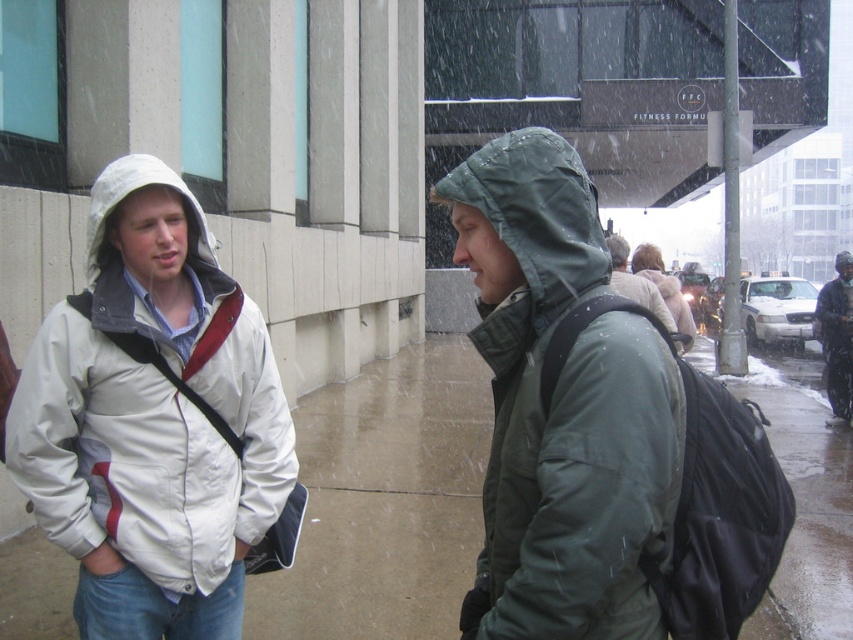
You are a fashion designer observing the two jackets in the image. Which jacket, the green matte jacket at center or the light beige wool coat at center, is narrower in width?

The green matte jacket at center is narrower in width than the light beige wool coat at center.

You are a delivery person trying to locate the recipient standing at the green matte jacket at center. According to the coordinates provided, where exactly should you look to find them?

The green matte jacket at center is located at point (x=561, y=406), so you should look towards those coordinates to find the recipient.

You are a delivery robot with a 1.2 meter wide package. You need to navigate through the space between the green matte jacket at center and the nearest building wall. Can the package fit through this space?

The distance between the green matte jacket at center and the camera is 1.41 meters. However, the space between the jacket and the nearest building wall isn not specified in the provided information. Without knowing the distance to the wall, it is impossible to determine if the 1.2 meter wide package can fit through the space.